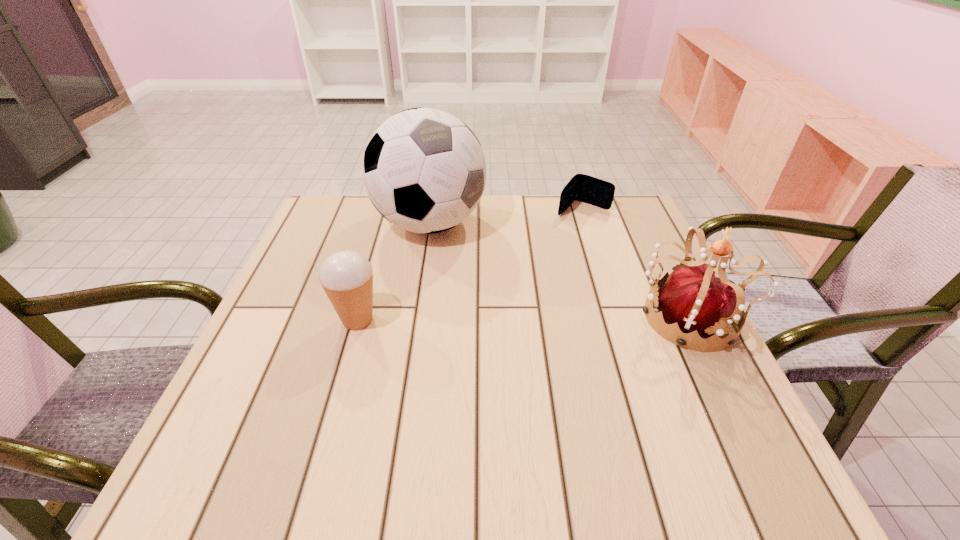
At what (x,y) coordinates should I click in order to perform the action: click on vacant region located on the main logo of the soccer ball. Please return your answer as a coordinate pair (x, y). The height and width of the screenshot is (540, 960). Looking at the image, I should click on (524, 360).

Find the location of a particular element. The width and height of the screenshot is (960, 540). wallet at the far edge is located at coordinates (584, 188).

This screenshot has height=540, width=960. Identify the location of soccer ball that is positioned at the far edge. pos(424,170).

Where is `object that is at the left edge`? Image resolution: width=960 pixels, height=540 pixels. object that is at the left edge is located at coordinates (347, 277).

Find the location of a particular element. This screenshot has width=960, height=540. tiara that is positioned at the right edge is located at coordinates (691, 298).

Find the location of a particular element. The image size is (960, 540). wallet present at the right edge is located at coordinates (584, 188).

Where is `object positioned at the far right corner`? object positioned at the far right corner is located at coordinates (584, 188).

Locate an element on the screen. free space at the far edge is located at coordinates (567, 237).

What are the coordinates of `vacant space at the near edge` in the screenshot? It's located at (343, 407).

In the image, there is a desktop. Where is `vacant space at the right edge`? The height and width of the screenshot is (540, 960). vacant space at the right edge is located at coordinates (711, 352).